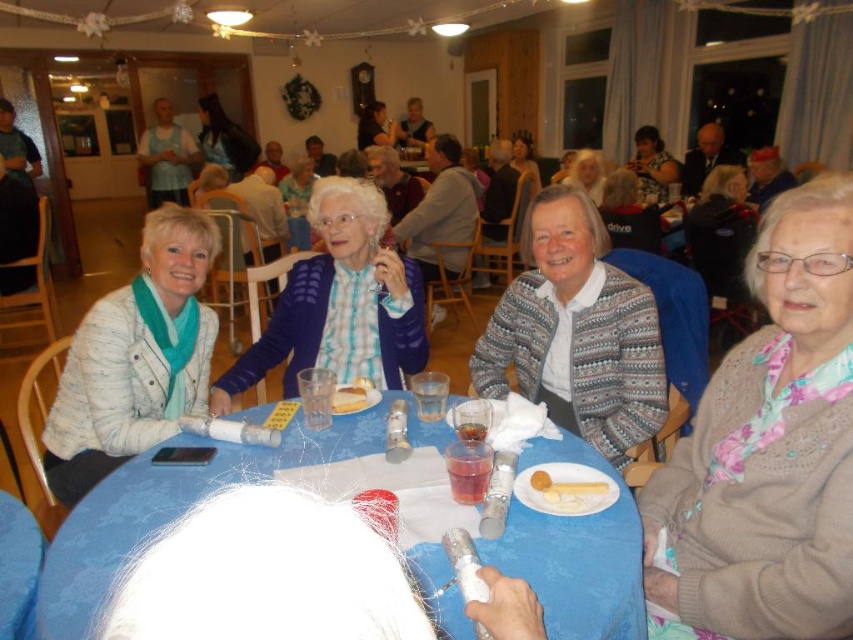
Is knitted sweater at center positioned at the back of matte blue sweater at center?

No, it is in front of matte blue sweater at center.

Is knitted sweater at center smaller than matte blue sweater at center?

Yes, knitted sweater at center is smaller than matte blue sweater at center.

Which is in front, point (602, 218) or point (366, 104)?

Point (602, 218) is more forward.

The width and height of the screenshot is (853, 640). Identify the location of knitted sweater at center. click(630, 212).

Does blue fabric table at center appear over matte gray sweater at upper center?

No, blue fabric table at center is not above matte gray sweater at upper center.

Where is `blue fabric table at center`? blue fabric table at center is located at coordinates (183, 506).

Does point (554, 556) come behind point (520, 147)?

That is False.

At what (x,y) coordinates should I click in order to perform the action: click on blue fabric table at center. Please return your answer as a coordinate pair (x, y). Looking at the image, I should click on (183, 506).

Who is lower down, white textured sweater at left or yellow sponge cake at center?

yellow sponge cake at center is below.

Does white textured sweater at left appear over yellow sponge cake at center?

Indeed, white textured sweater at left is positioned over yellow sponge cake at center.

Image resolution: width=853 pixels, height=640 pixels. I want to click on white textured sweater at left, so click(x=135, y=356).